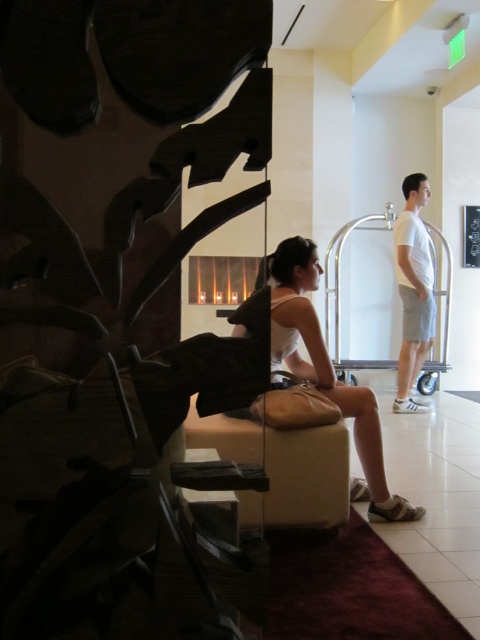
Can you confirm if brown leather stool at center is thinner than white matte t-shirt at right?

No, brown leather stool at center is not thinner than white matte t-shirt at right.

I want to click on brown leather stool at center, so click(282, 468).

Who is positioned more to the right, brown leather stool at center or white matte purse at center?

white matte purse at center

Which is above, brown leather stool at center or white matte purse at center?

white matte purse at center

Who is more forward, (x=343, y=436) or (x=314, y=364)?

Point (x=343, y=436) is in front.

This screenshot has height=640, width=480. In order to click on brown leather stool at center in this screenshot , I will do `click(282, 468)`.

Can you confirm if white matte purse at center is smaller than white matte t-shirt at right?

Yes.

Does white matte purse at center appear over white matte t-shirt at right?

No.

The height and width of the screenshot is (640, 480). I want to click on white matte purse at center, so click(x=327, y=371).